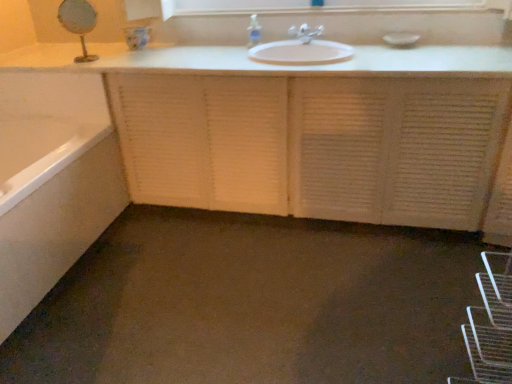
Where is `white glossy medicine cabinet at upper center`? This screenshot has width=512, height=384. white glossy medicine cabinet at upper center is located at coordinates (308, 6).

Describe the element at coordinates (254, 32) in the screenshot. Image resolution: width=512 pixels, height=384 pixels. I see `clear plastic soap dispenser at upper center` at that location.

The height and width of the screenshot is (384, 512). In order to click on white glossy medicine cabinet at upper center in this screenshot , I will do `click(308, 6)`.

Can you tell me how much gold metallic mirror at upper left and matte white faucet at center differ in facing direction?

gold metallic mirror at upper left and matte white faucet at center are facing 36.6 degrees away from each other.

Consider the image. Between gold metallic mirror at upper left and matte white faucet at center, which one appears on the right side from the viewer's perspective?

From the viewer's perspective, matte white faucet at center appears more on the right side.

Is gold metallic mirror at upper left oriented towards matte white faucet at center?

No.

Is matte white faucet at center positioned with its back to white glossy medicine cabinet at upper center?

No.

Is matte white faucet at center outside of white glossy medicine cabinet at upper center?

matte white faucet at center is positioned outside white glossy medicine cabinet at upper center.

Is matte white faucet at center far from white glossy medicine cabinet at upper center?

No.

Can you confirm if clear plastic soap dispenser at upper center is thinner than matte white faucet at center?

Yes, clear plastic soap dispenser at upper center is thinner than matte white faucet at center.

From a real-world perspective, does clear plastic soap dispenser at upper center sit lower than matte white faucet at center?

No.

Is matte white faucet at center completely or partially inside clear plastic soap dispenser at upper center?

Actually, matte white faucet at center is outside clear plastic soap dispenser at upper center.

Considering the positions of point (242, 83) and point (93, 13), is point (242, 83) closer or farther from the camera than point (93, 13)?

Point (242, 83).

Find the location of `mirror that appears above the white textured cabinet at center (from a real-world perspective)`. mirror that appears above the white textured cabinet at center (from a real-world perspective) is located at coordinates (78, 23).

Based on the photo, is white textured cabinet at center positioned with its back to gold metallic mirror at upper left?

No, white textured cabinet at center's orientation is not away from gold metallic mirror at upper left.

Between white textured cabinet at center and gold metallic mirror at upper left, which one has smaller width?

Thinner between the two is gold metallic mirror at upper left.

Is gold metallic mirror at upper left far from clear plastic soap dispenser at upper center?

gold metallic mirror at upper left is actually quite close to clear plastic soap dispenser at upper center.

Based on the photo, is gold metallic mirror at upper left at the right side of clear plastic soap dispenser at upper center?

No.

From the picture: Which of these two, gold metallic mirror at upper left or clear plastic soap dispenser at upper center, is bigger?

gold metallic mirror at upper left.

From the image's perspective, between gold metallic mirror at upper left and clear plastic soap dispenser at upper center, who is located below?

gold metallic mirror at upper left is shown below in the image.

The width and height of the screenshot is (512, 384). Identify the location of bathtub below the matte white faucet at center (from the image's perspective). (52, 182).

Which of these two, white glossy bathtub at lower left or matte white faucet at center, stands taller?

white glossy bathtub at lower left is taller.

Is white glossy bathtub at lower left smaller than matte white faucet at center?

No.

Measure the distance from white glossy bathtub at lower left to matte white faucet at center.

white glossy bathtub at lower left is 1.43 meters away from matte white faucet at center.

Looking at this image, is white glossy bathtub at lower left with white textured cabinet at center?

No, white glossy bathtub at lower left is not with white textured cabinet at center.

Is point (16, 142) more distant than point (344, 80)?

That is True.

How many degrees apart are the facing directions of white glossy bathtub at lower left and white textured cabinet at center?

The angular difference between white glossy bathtub at lower left and white textured cabinet at center is 90.1 degrees.

From a real-world perspective, is white glossy bathtub at lower left physically located above or below white textured cabinet at center?

Clearly, from a real-world perspective, white glossy bathtub at lower left is below white textured cabinet at center.

Identify the location of tap to the right of gold metallic mirror at upper left. (305, 33).

You are a GUI agent. You are given a task and a screenshot of the screen. Output one action in this format:
    pyautogui.click(x=<x>, y=<y>)
    Task: Click on the tap that appears below the white glossy medicine cabinet at upper center (from a real-world perspective)
    This screenshot has width=512, height=384.
    Given the screenshot: What is the action you would take?
    pyautogui.click(x=305, y=33)

Considering their positions, is clear plastic soap dispenser at upper center positioned further to white textured cabinet at center than white glossy bathtub at lower left?

The object further to white textured cabinet at center is clear plastic soap dispenser at upper center.

Estimate the real-world distances between objects in this image. Which object is closer to clear plastic soap dispenser at upper center, white textured cabinet at center or white glossy medicine cabinet at upper center?

Based on the image, white glossy medicine cabinet at upper center appears to be nearer to clear plastic soap dispenser at upper center.

From the image, which object appears to be nearer to matte white faucet at center, gold metallic mirror at upper left or white textured cabinet at center?

white textured cabinet at center is closer to matte white faucet at center.

Looking at this image, looking at the image, which one is located closer to white glossy medicine cabinet at upper center, gold metallic mirror at upper left or white textured cabinet at center?

gold metallic mirror at upper left is closer to white glossy medicine cabinet at upper center.

When comparing their distances from white glossy bathtub at lower left, does gold metallic mirror at upper left or matte white faucet at center seem closer?

gold metallic mirror at upper left is closer to white glossy bathtub at lower left.

Which object lies further to the anchor point white textured cabinet at center, matte white faucet at center or gold metallic mirror at upper left?

Based on the image, gold metallic mirror at upper left appears to be further to white textured cabinet at center.

Based on their spatial positions, is white glossy bathtub at lower left or white textured cabinet at center closer to clear plastic soap dispenser at upper center?

white textured cabinet at center is closer to clear plastic soap dispenser at upper center.

Based on their spatial positions, is white textured cabinet at center or white glossy medicine cabinet at upper center closer to white glossy bathtub at lower left?

white textured cabinet at center is closer to white glossy bathtub at lower left.

Locate an element on the screen. The height and width of the screenshot is (384, 512). mirror between white glossy bathtub at lower left and clear plastic soap dispenser at upper center in the horizontal direction is located at coordinates (78, 23).

Where is `tap between white glossy bathtub at lower left and white glossy medicine cabinet at upper center`? tap between white glossy bathtub at lower left and white glossy medicine cabinet at upper center is located at coordinates (305, 33).

Locate an element on the screen. Image resolution: width=512 pixels, height=384 pixels. soap dispenser between white glossy bathtub at lower left and white textured cabinet at center is located at coordinates (254, 32).

Locate an element on the screen. soap dispenser between gold metallic mirror at upper left and white glossy medicine cabinet at upper center is located at coordinates (254, 32).